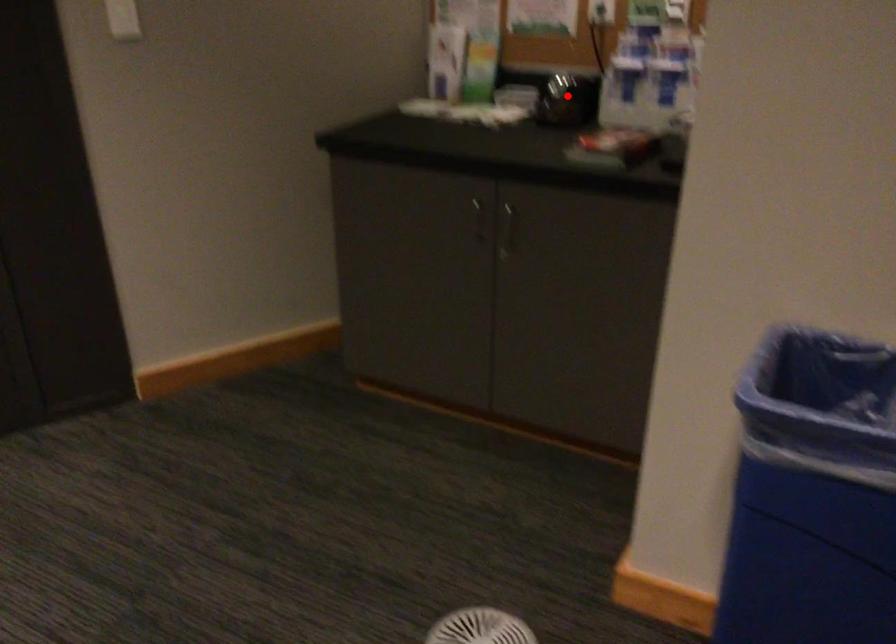
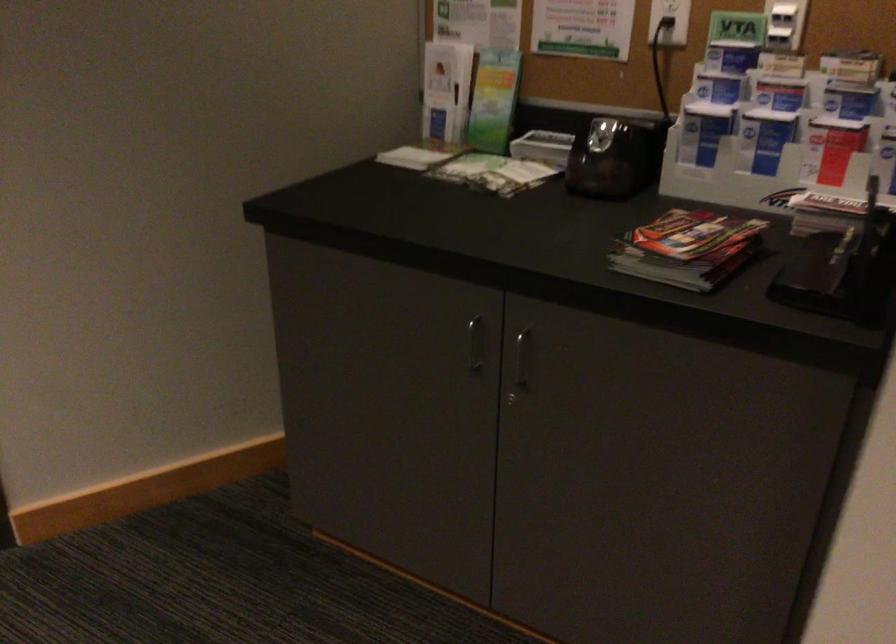
Question: I am providing you with two images of the same scene from different viewpoints. Image1 has a red point marked. In image2, the corresponding 3D location appears at what relative position? Reply with the corresponding letter.

Choices:
 (A) Closer
 (B) Farther

Answer: (A)